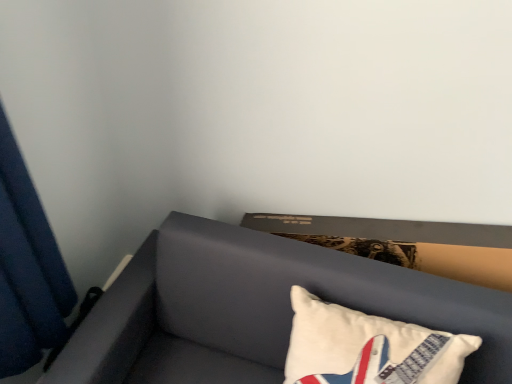
Question: Considering the relative positions of blue fabric curtain at left and white cotton pillow at lower right in the image provided, is blue fabric curtain at left to the left of white cotton pillow at lower right from the viewer's perspective?

Choices:
 (A) yes
 (B) no

Answer: (A)

Question: Is blue fabric curtain at left completely or partially outside of white cotton pillow at lower right?

Choices:
 (A) yes
 (B) no

Answer: (A)

Question: Does blue fabric curtain at left touch white cotton pillow at lower right?

Choices:
 (A) no
 (B) yes

Answer: (A)

Question: From a real-world perspective, is blue fabric curtain at left physically above white cotton pillow at lower right?

Choices:
 (A) no
 (B) yes

Answer: (B)

Question: Can you confirm if blue fabric curtain at left is smaller than white cotton pillow at lower right?

Choices:
 (A) no
 (B) yes

Answer: (A)

Question: From their relative heights in the image, would you say blue fabric curtain at left is taller or shorter than suede-like gray sofa at lower right?

Choices:
 (A) tall
 (B) short

Answer: (A)

Question: From the image's perspective, is blue fabric curtain at left above or below suede-like gray sofa at lower right?

Choices:
 (A) below
 (B) above

Answer: (B)

Question: Considering the positions of blue fabric curtain at left and suede-like gray sofa at lower right in the image, is blue fabric curtain at left bigger or smaller than suede-like gray sofa at lower right?

Choices:
 (A) small
 (B) big

Answer: (A)

Question: Is blue fabric curtain at left in front of or behind suede-like gray sofa at lower right in the image?

Choices:
 (A) behind
 (B) front

Answer: (B)

Question: Considering the positions of suede-like gray sofa at lower right and white cotton pillow at lower right in the image, is suede-like gray sofa at lower right wider or thinner than white cotton pillow at lower right?

Choices:
 (A) wide
 (B) thin

Answer: (A)

Question: Considering the positions of point (509, 349) and point (432, 374), is point (509, 349) closer or farther from the camera than point (432, 374)?

Choices:
 (A) closer
 (B) farther

Answer: (B)

Question: Is suede-like gray sofa at lower right taller or shorter than white cotton pillow at lower right?

Choices:
 (A) tall
 (B) short

Answer: (A)

Question: From a real-world perspective, is suede-like gray sofa at lower right above or below white cotton pillow at lower right?

Choices:
 (A) below
 (B) above

Answer: (A)

Question: Considering the relative positions of white cotton pillow at lower right and suede-like gray sofa at lower right in the image provided, is white cotton pillow at lower right to the left or to the right of suede-like gray sofa at lower right?

Choices:
 (A) right
 (B) left

Answer: (A)

Question: Considering the positions of point (435, 352) and point (460, 296), is point (435, 352) closer or farther from the camera than point (460, 296)?

Choices:
 (A) closer
 (B) farther

Answer: (A)